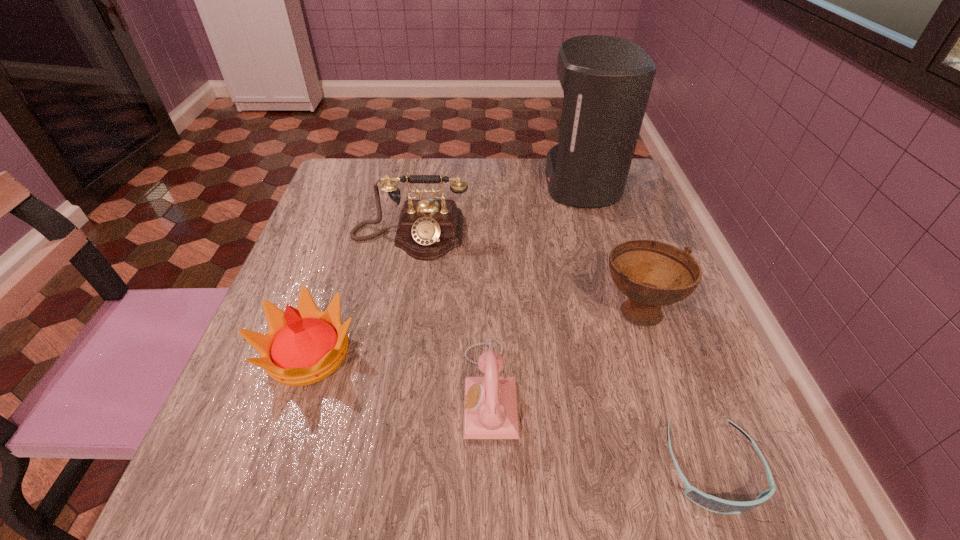
Identify the location of the farthest object. This screenshot has height=540, width=960. tap(606, 80).

At what (x,y) coordinates should I click in order to perform the action: click on the tallest object. Please return your answer as a coordinate pair (x, y). Image resolution: width=960 pixels, height=540 pixels. Looking at the image, I should click on pyautogui.click(x=606, y=80).

Where is `the second farthest object`? This screenshot has width=960, height=540. the second farthest object is located at coordinates tap(428, 229).

Identify the location of the taller telephone. Image resolution: width=960 pixels, height=540 pixels. pos(428,229).

The image size is (960, 540). I want to click on soup bowl, so pyautogui.click(x=652, y=274).

The image size is (960, 540). In order to click on crown in this screenshot , I will do [303, 346].

This screenshot has height=540, width=960. I want to click on the shorter telephone, so click(490, 403).

What are the coordinates of `the second shortest object` in the screenshot? It's located at (490, 403).

Find the location of a particular element. The image size is (960, 540). goggles is located at coordinates (708, 502).

Identify the location of free location located 0.360m on the button side of the tallest object. This screenshot has height=540, width=960. (407, 183).